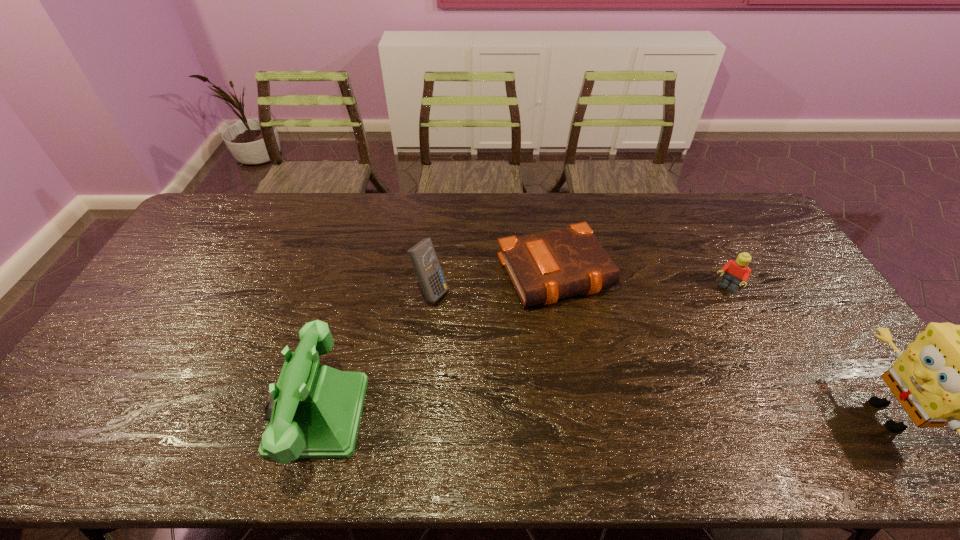
Where is `vacant space that's between the second tallest object and the fourth object from right to left`? The height and width of the screenshot is (540, 960). vacant space that's between the second tallest object and the fourth object from right to left is located at coordinates (373, 353).

Where is `free spot between the fourth object from left to right and the telephone`? free spot between the fourth object from left to right and the telephone is located at coordinates (521, 352).

Locate an element on the screen. object that is the closest to the rightmost object is located at coordinates (737, 271).

Locate which object ranks in proximity to the Bible. Please provide its 2D coordinates. Your answer should be formatted as a tuple, i.e. [(x, y)], where the tuple contains the x and y coordinates of a point satisfying the conditions above.

[(422, 255)]

Locate an element on the screen. This screenshot has height=540, width=960. blank space that satisfies the following two spatial constraints: 1. on the front side of the shortest object; 2. on the right side of the Lego is located at coordinates (561, 289).

Identify the location of free spot that satisfies the following two spatial constraints: 1. on the front side of the third object from right to left; 2. on the left side of the second object from right to left. (561, 289).